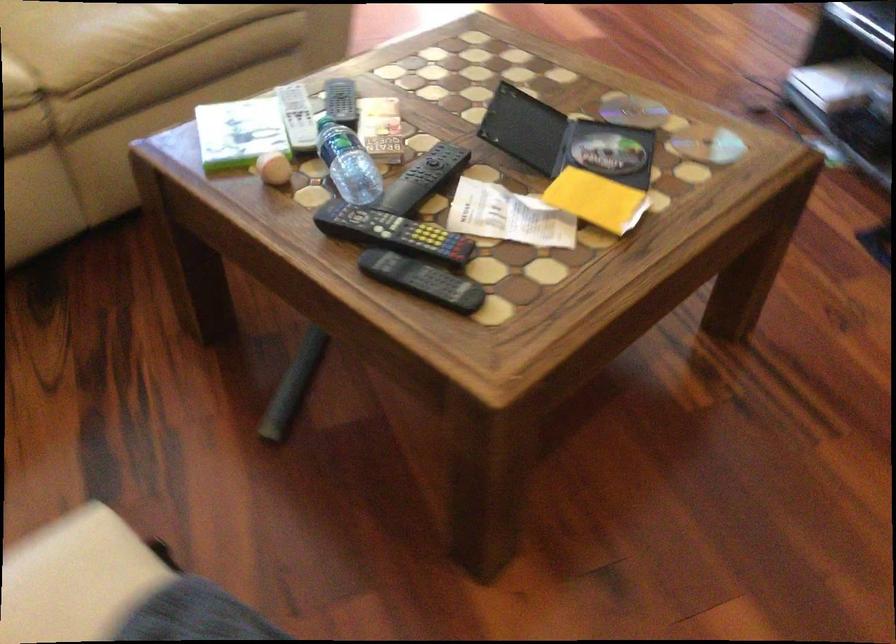
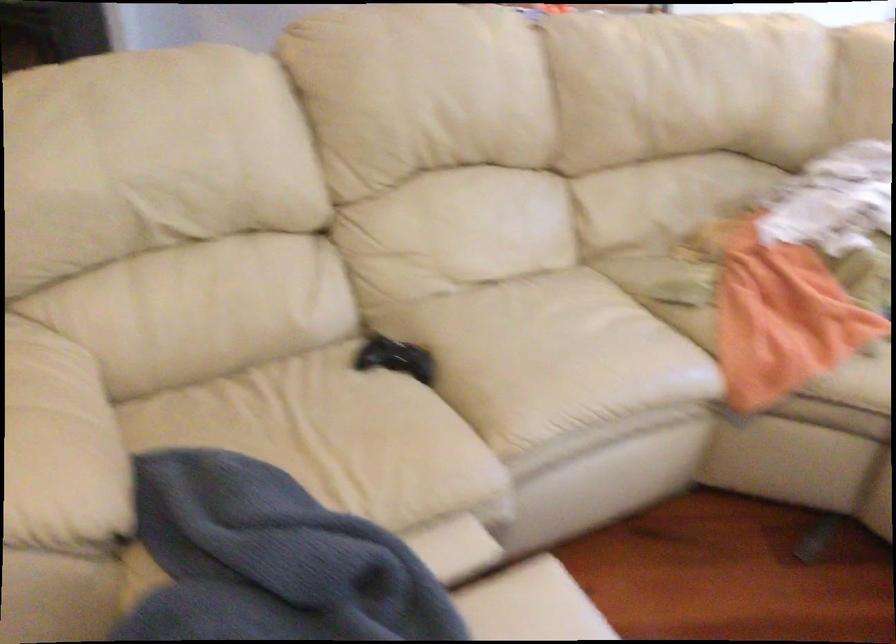
The first image is from the beginning of the video and the second image is from the end. How did the camera likely rotate when shooting the video?

The camera's rotation is toward left-down.